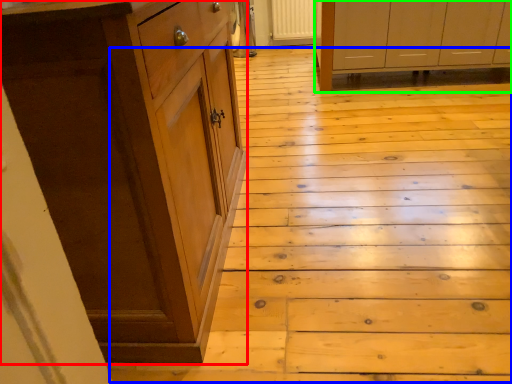
Question: Which is nearer to the cabinetry (highlighted by a red box)? stair (highlighted by a blue box) or cabinetry (highlighted by a green box).

Choices:
 (A) stair
 (B) cabinetry

Answer: (A)